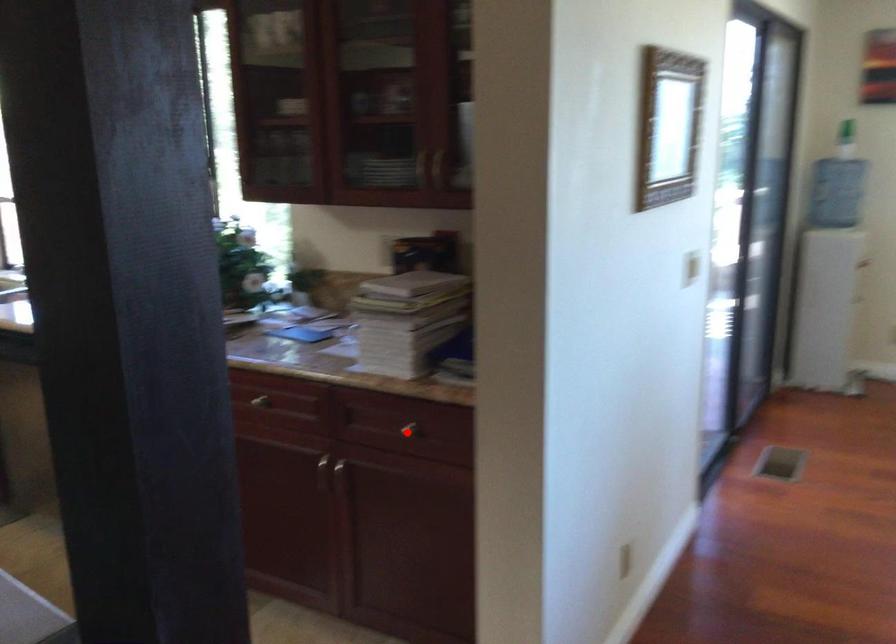
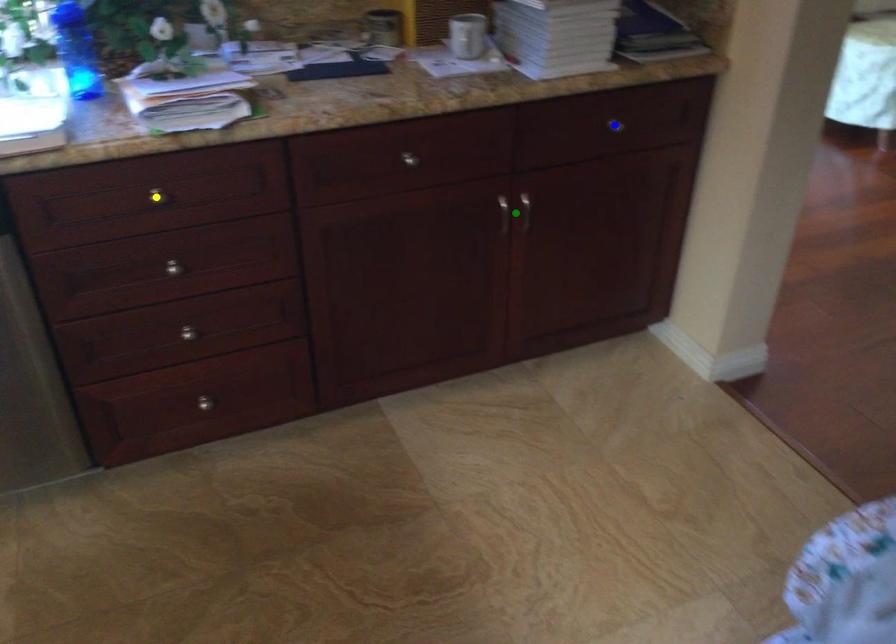
Question: I am providing you with two images of the same scene from different viewpoints. A red point is marked on the first image. You are given multiple points on the second image. Can you choose the point in image 2 that corresponds to the point in image 1?

Choices:
 (A) yellow point
 (B) green point
 (C) blue point

Answer: (C)